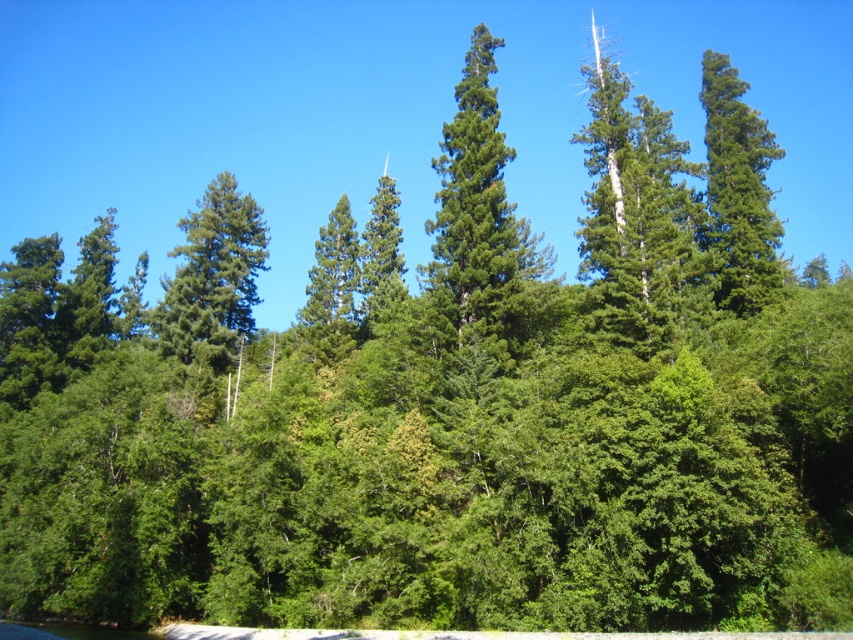
Is green needle-like at center taller than green matte tree at upper right?

Indeed, green needle-like at center has a greater height compared to green matte tree at upper right.

Does green needle-like at center appear over green matte tree at upper right?

Yes, green needle-like at center is above green matte tree at upper right.

Where is `green needle-like at center`? green needle-like at center is located at coordinates (479, 221).

This screenshot has width=853, height=640. Find the location of `green needle-like at center`. green needle-like at center is located at coordinates click(479, 221).

Does green needle-like at center have a greater height compared to green matte tree at center?

Yes.

Where is `green needle-like at center`? The height and width of the screenshot is (640, 853). green needle-like at center is located at coordinates (479, 221).

This screenshot has height=640, width=853. I want to click on green needle-like at center, so coord(479,221).

At what (x,y) coordinates should I click in order to perform the action: click on green needle-like at center. Please return your answer as a coordinate pair (x, y). The image size is (853, 640). Looking at the image, I should click on (479, 221).

How much distance is there between green matte tree at upper right and green matte tree at center?

They are 35.54 meters apart.

Can you confirm if green matte tree at upper right is smaller than green matte tree at center?

No, green matte tree at upper right is not smaller than green matte tree at center.

Does point (764, 250) come closer to viewer compared to point (172, 282)?

Yes, point (764, 250) is in front of point (172, 282).

Locate an element on the screen. green matte tree at upper right is located at coordinates (737, 192).